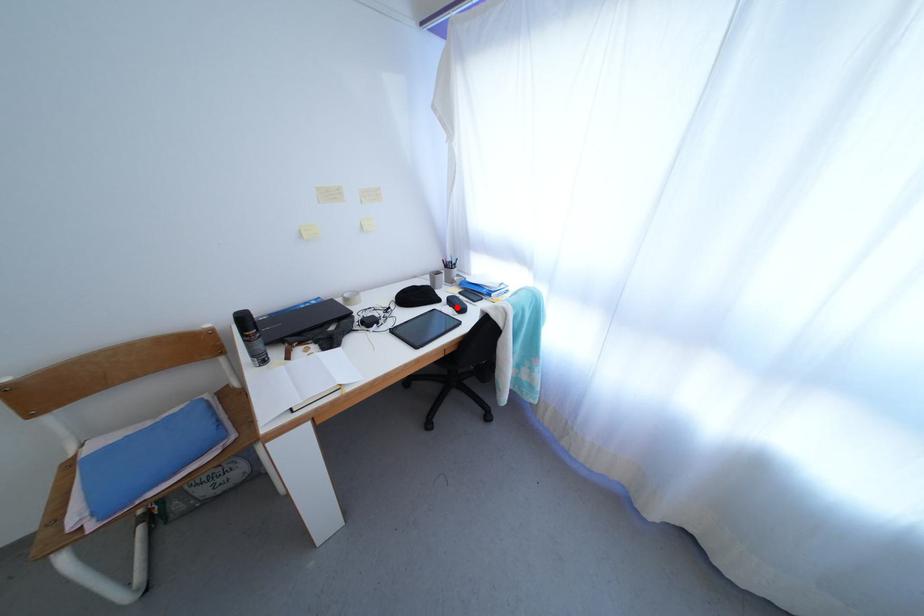
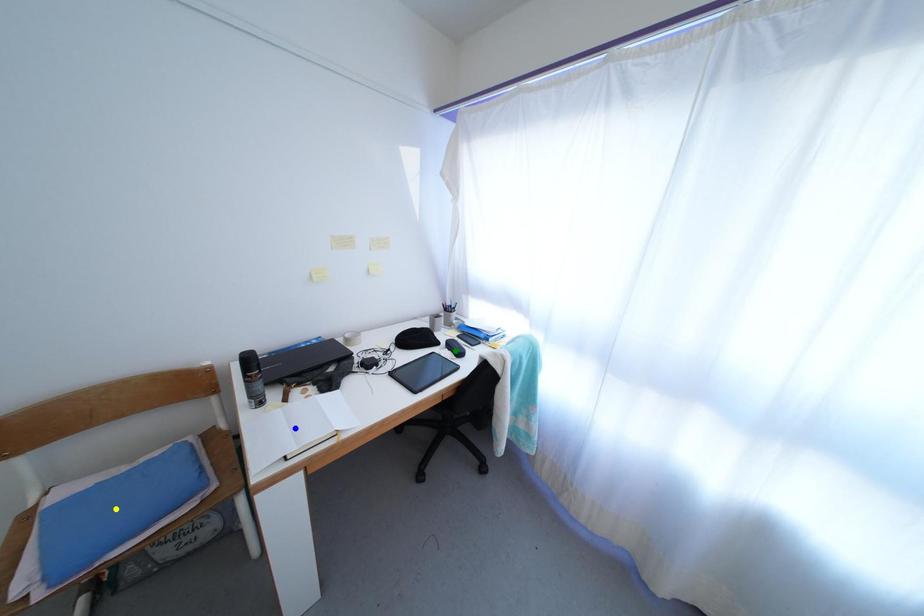
Question: I am providing you with two images of the same scene from different viewpoints. A red point is marked on the first image. You are given multiple points on the second image. Which point in image 2 is actually the same real-world point as the red point in image 1?

Choices:
 (A) green point
 (B) blue point
 (C) yellow point

Answer: (A)